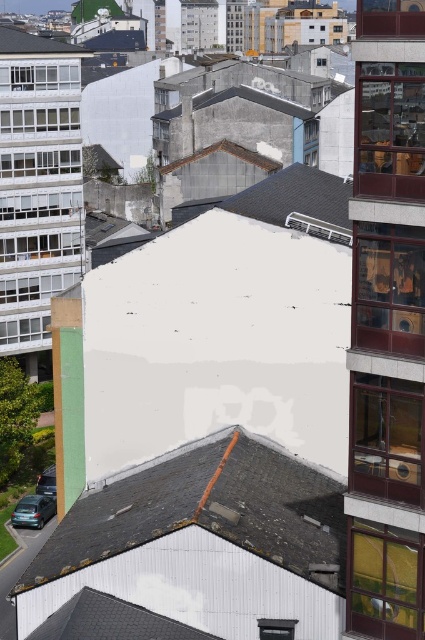
Based on the photo, you are a delivery person trying to park your vehicle in the urban scene. You see the white shingles at upper left and the shiny black car at lower left. Which object is positioned higher up in the image?

The white shingles at upper left are positioned higher up in the image than the shiny black car at lower left.

You are a city planner assessing building dimensions. You notice the gray slate roof at lower center and the gray slate roof at lower left. Based on the scene, can you determine which roof has a greater width?

The gray slate roof at lower center might be wider than gray slate roof at lower left according to the description.

You are a delivery drone that is 1.5 meters wide. You need to fly between the gray slate roof at lower center and the gray slate roof at lower left to deliver a package. Is there enough space for you to pass through?

The distance between the gray slate roof at lower center and the gray slate roof at lower left is 3.83 meters. Since the drone is 1.5 meters wide, there is sufficient space for it to pass through as the distance is greater than the drone width.